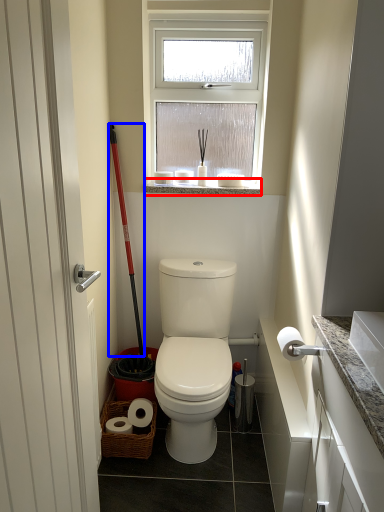
Question: Which of the following is the farthest to the observer, window sill (highlighted by a red box) or ski pole (highlighted by a blue box)?

Choices:
 (A) window sill
 (B) ski pole

Answer: (A)